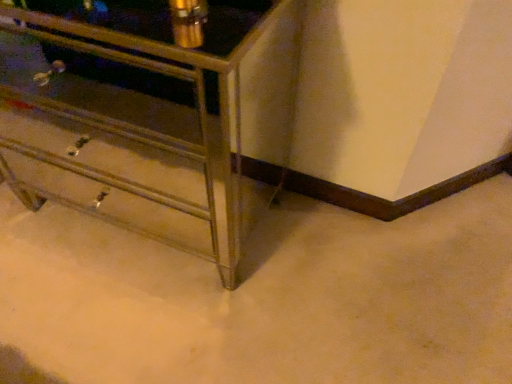
Identify the location of free space to the right of metallic mirrored chest of drawers at lower left. The height and width of the screenshot is (384, 512). pyautogui.click(x=355, y=273).